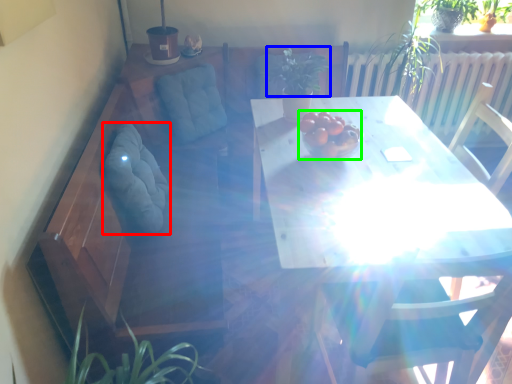
Question: Which object is positioned closest to swivel chair (highlighted by a red box)? Select from plant (highlighted by a blue box) and fruit (highlighted by a green box).

Choices:
 (A) plant
 (B) fruit

Answer: (B)